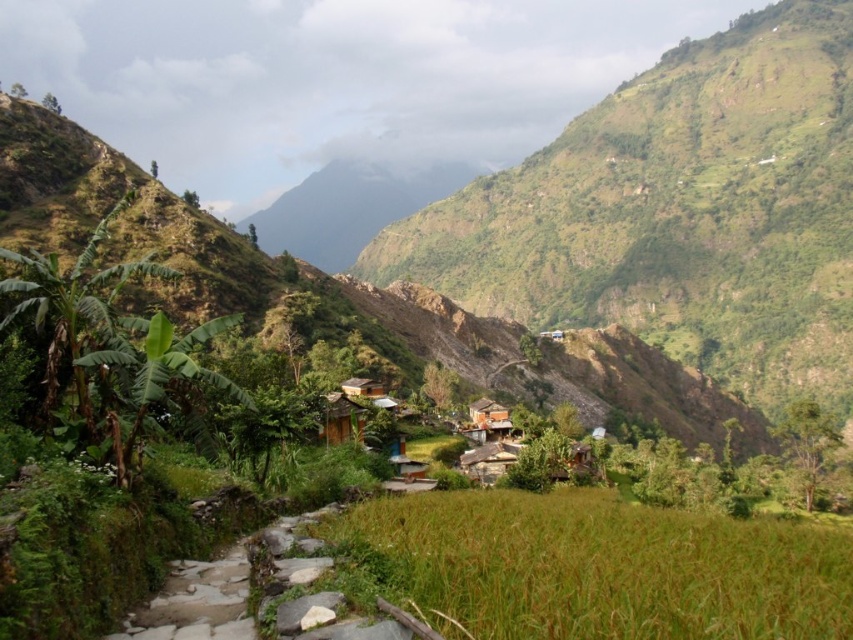
You are planning to build a small garden between the green grassy hill at center and the gray stone path at lower left. Which area has more space for planting?

The green grassy hill at center might be wider than the gray stone path at lower left, so it likely has more space for planting.

You are a tourist standing at the entrance of the gray stone path at lower left and want to reach the brown wooden hut at center. Which direction should you walk to get there?

You should walk to the right because the gray stone path at lower left is to the left of the brown wooden hut at center, so moving right along the path will lead you towards the hut.